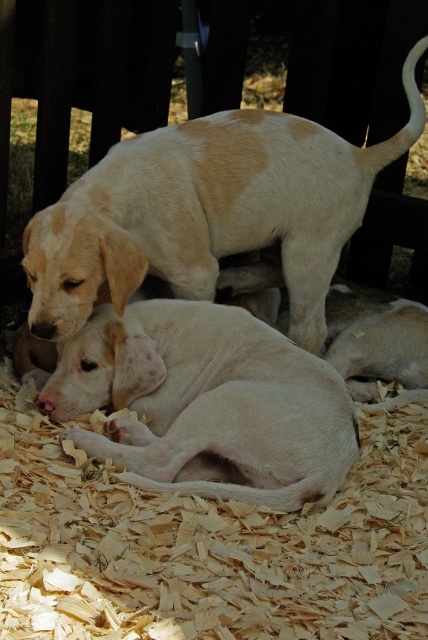
You are a dog owner observing the scene from the left side of the image. You notice the light brown woodchip at lower center and the light brown fur at upper center. Which object is closer to the ground?

The light brown woodchip at lower center is closer to the ground because it is not as tall as the light brown fur at upper center.

You are a dog owner who wants to ensure the puppies are safe. You notice the light brown woodchip at lower center and the light beige fur at center. Which object is larger?

The light brown woodchip at lower center is bigger than the light beige fur at center.

Looking at the two puppies in the image, one with light brown fur at upper center and the other with light beige fur at center, which puppy is wider?

The light brown fur at upper center is wider than the light beige fur at center.